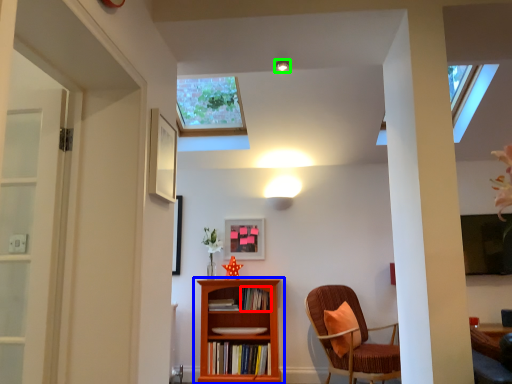
Question: Which is nearer to the book (highlighted by a red box)? bookcase (highlighted by a blue box) or light fixture (highlighted by a green box).

Choices:
 (A) bookcase
 (B) light fixture

Answer: (A)